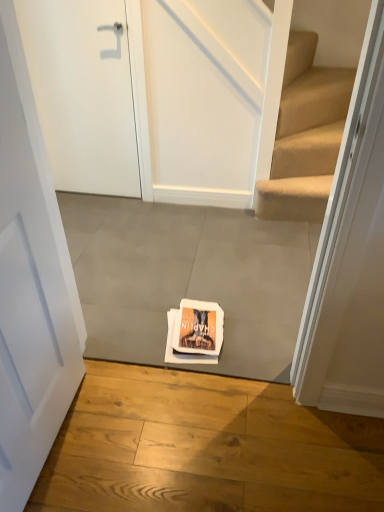
Where is `blank space above gray concrete at center, the second concrete when ordered from back to front (from a real-world perspective)`? This screenshot has width=384, height=512. blank space above gray concrete at center, the second concrete when ordered from back to front (from a real-world perspective) is located at coordinates (194, 445).